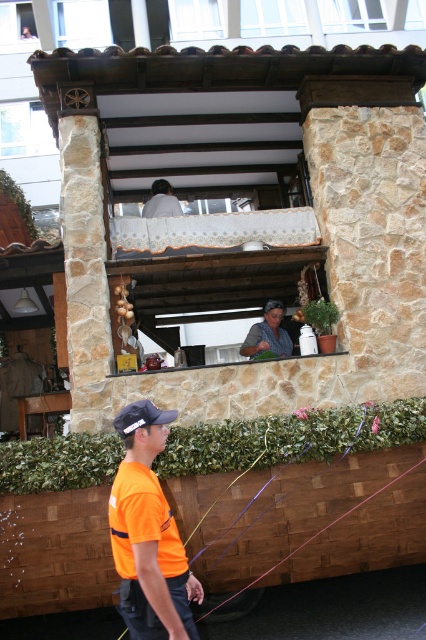
You are standing at the entrance of the wooden food stall and want to find the orange fabric shirt at lower left. According to the coordinates provided, where should you look relative to the stall?

The orange fabric shirt at lower left is located at point 0.834 on the x axis and 0.350 on the y axis, so you should look towards the right side and slightly below the center of the stall.

You are a customer at the food stall and want to know which of the two staff members is closer to the entrance. The entrance is located at the lower left corner of the stall. The staff members are wearing the orange fabric shirt at lower left and the matte gray shirt at center. Based on their positions, which staff member is closer to the entrance?

The orange fabric shirt at lower left is closer to the entrance since it is positioned at the lower left corner of the stall, which is where the entrance is located.

You are a photographer trying to capture both the orange fabric shirt at lower left and the matte gray shirt at center in a single shot. Given that your camera can only focus on one subject at a time, which shirt should you focus on to ensure the taller one is in focus?

The orange fabric shirt at lower left is taller than the matte gray shirt at center, so you should focus on the orange fabric shirt at lower left to ensure the taller one is in focus.